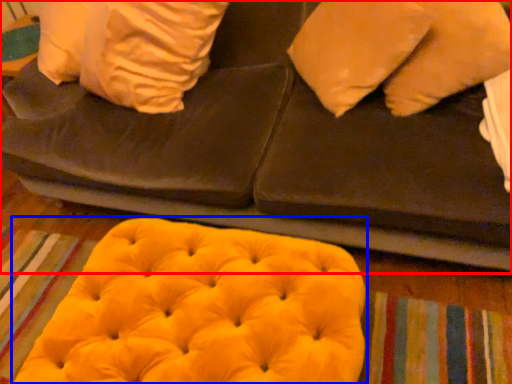
Question: Which point is further to the camera, furniture (highlighted by a red box) or bean bag chair (highlighted by a blue box)?

Choices:
 (A) furniture
 (B) bean bag chair

Answer: (B)